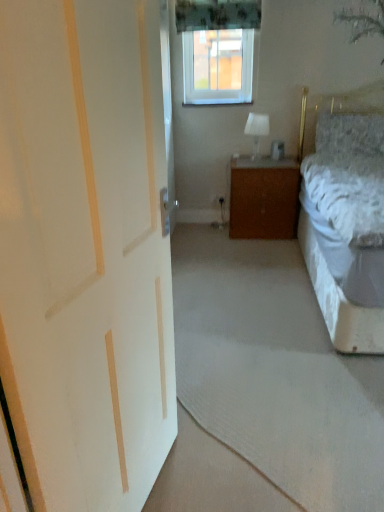
Question: From the image's perspective, is white painted wood door at left located above wooden cabinet at center?

Choices:
 (A) yes
 (B) no

Answer: (B)

Question: Does white painted wood door at left have a lesser height compared to wooden cabinet at center?

Choices:
 (A) yes
 (B) no

Answer: (B)

Question: Is white painted wood door at left in front of wooden cabinet at center?

Choices:
 (A) no
 (B) yes

Answer: (B)

Question: Does white painted wood door at left have a smaller size compared to wooden cabinet at center?

Choices:
 (A) no
 (B) yes

Answer: (B)

Question: Considering the relative positions of white painted wood door at left and wooden cabinet at center in the image provided, is white painted wood door at left to the left of wooden cabinet at center from the viewer's perspective?

Choices:
 (A) yes
 (B) no

Answer: (A)

Question: From a real-world perspective, relative to wooden cabinet at center, is white painted wood door at left vertically above or below?

Choices:
 (A) above
 (B) below

Answer: (A)

Question: From the image's perspective, relative to wooden cabinet at center, is white painted wood door at left above or below?

Choices:
 (A) above
 (B) below

Answer: (B)

Question: Considering the positions of point (160, 77) and point (231, 182), is point (160, 77) closer or farther from the camera than point (231, 182)?

Choices:
 (A) farther
 (B) closer

Answer: (B)

Question: Would you say white painted wood door at left is to the left or to the right of wooden cabinet at center in the picture?

Choices:
 (A) right
 (B) left

Answer: (B)

Question: From a real-world perspective, is green floral fabric curtain at upper center physically located above or below fluffy gray pillow at upper right?

Choices:
 (A) below
 (B) above

Answer: (B)

Question: Considering the positions of point (258, 26) and point (360, 136), is point (258, 26) closer or farther from the camera than point (360, 136)?

Choices:
 (A) farther
 (B) closer

Answer: (B)

Question: From the image's perspective, is green floral fabric curtain at upper center above or below fluffy gray pillow at upper right?

Choices:
 (A) above
 (B) below

Answer: (A)

Question: Visually, is green floral fabric curtain at upper center positioned to the left or to the right of fluffy gray pillow at upper right?

Choices:
 (A) left
 (B) right

Answer: (A)

Question: Looking at their shapes, would you say white fabric lampshade at upper center is wider or thinner than clear plastic window screen at upper center?

Choices:
 (A) thin
 (B) wide

Answer: (B)

Question: From a real-world perspective, is white fabric lampshade at upper center positioned above or below clear plastic window screen at upper center?

Choices:
 (A) below
 (B) above

Answer: (A)